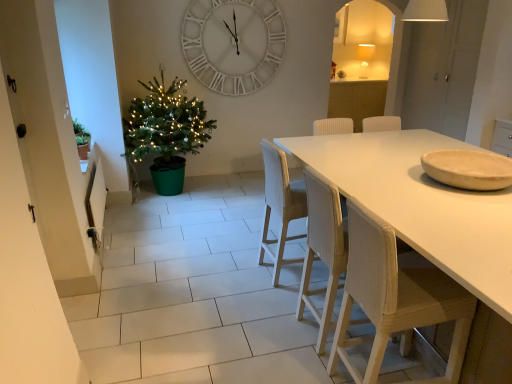
Question: Considering the relative sizes of white woven chair at center, arranged as the 2th chair when viewed from the back, and woven wood chair at center, which is counted as the 3th chair, starting from the front, in the image provided, is white woven chair at center, arranged as the 2th chair when viewed from the back, taller than woven wood chair at center, which is counted as the 3th chair, starting from the front,?

Choices:
 (A) yes
 (B) no

Answer: (B)

Question: Could you tell me if white woven chair at center, arranged as the 2th chair when viewed from the back, is turned towards woven wood chair at center, the 1th chair in the back-to-front sequence?

Choices:
 (A) no
 (B) yes

Answer: (A)

Question: Are white woven chair at center, which is the second chair in front-to-back order, and woven wood chair at center, which is counted as the 3th chair, starting from the front, making contact?

Choices:
 (A) yes
 (B) no

Answer: (B)

Question: Does white woven chair at center, which is the second chair in front-to-back order, have a larger size compared to woven wood chair at center, the 1th chair in the back-to-front sequence?

Choices:
 (A) no
 (B) yes

Answer: (A)

Question: Can you confirm if white woven chair at center, arranged as the 2th chair when viewed from the back, is smaller than woven wood chair at center, which is counted as the 3th chair, starting from the front?

Choices:
 (A) yes
 (B) no

Answer: (A)

Question: Is white woven chair at center, which is the second chair in front-to-back order, thinner than woven wood chair at center, which is counted as the 3th chair, starting from the front?

Choices:
 (A) no
 (B) yes

Answer: (A)

Question: Can you confirm if white matte table at center is positioned to the left of wooden bowl at right?

Choices:
 (A) no
 (B) yes

Answer: (B)

Question: Can you confirm if white matte table at center is positioned to the right of wooden bowl at right?

Choices:
 (A) no
 (B) yes

Answer: (A)

Question: From a real-world perspective, is white matte table at center below wooden bowl at right?

Choices:
 (A) no
 (B) yes

Answer: (B)

Question: Is white matte table at center beside wooden bowl at right?

Choices:
 (A) yes
 (B) no

Answer: (B)

Question: Is white matte table at center aimed at wooden bowl at right?

Choices:
 (A) yes
 (B) no

Answer: (B)

Question: Can we say white matte table at center lies outside wooden bowl at right?

Choices:
 (A) yes
 (B) no

Answer: (A)

Question: From the image's perspective, is green matte christmas tree at left over green matte plant at left?

Choices:
 (A) yes
 (B) no

Answer: (A)